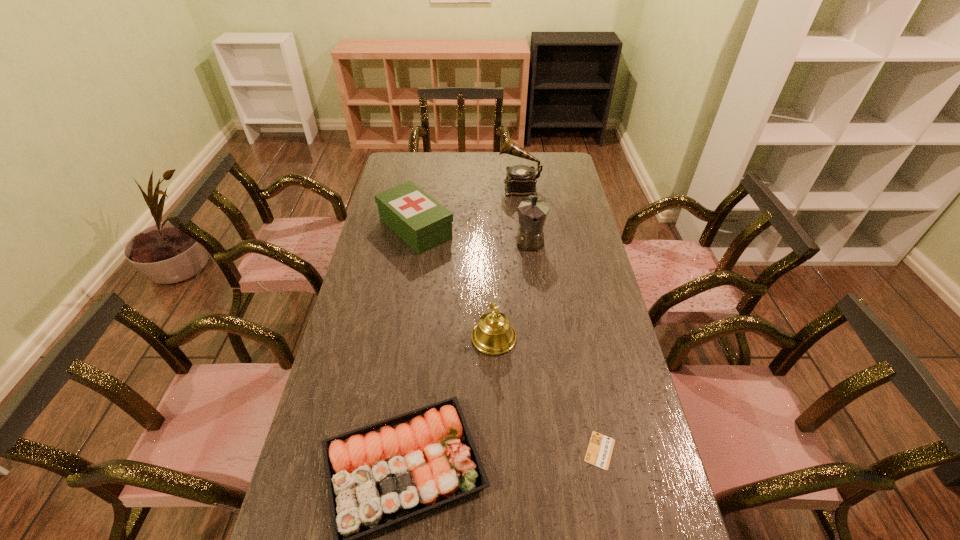
Where is `phonograph record`? The image size is (960, 540). phonograph record is located at coordinates (520, 180).

Identify the location of coffeepot. The image size is (960, 540). point(532,213).

Locate an element on the screen. The height and width of the screenshot is (540, 960). the fourth shortest object is located at coordinates (494, 335).

Where is `bell`? bell is located at coordinates (494, 335).

The height and width of the screenshot is (540, 960). In order to click on the third shortest object in this screenshot , I will do `click(419, 220)`.

Identify the location of identity card. (600, 447).

Locate an element on the screen. vacant region located on the horn of the phonograph record is located at coordinates (412, 187).

Locate an element on the screen. vacant region located on the horn of the phonograph record is located at coordinates (474, 187).

Find the location of a particular element. This screenshot has height=540, width=960. vacant space located 0.130m on the horn of the phonograph record is located at coordinates tap(470, 187).

Identify the location of vacant area situated on the pouring side of the coffeepot. The height and width of the screenshot is (540, 960). (535, 280).